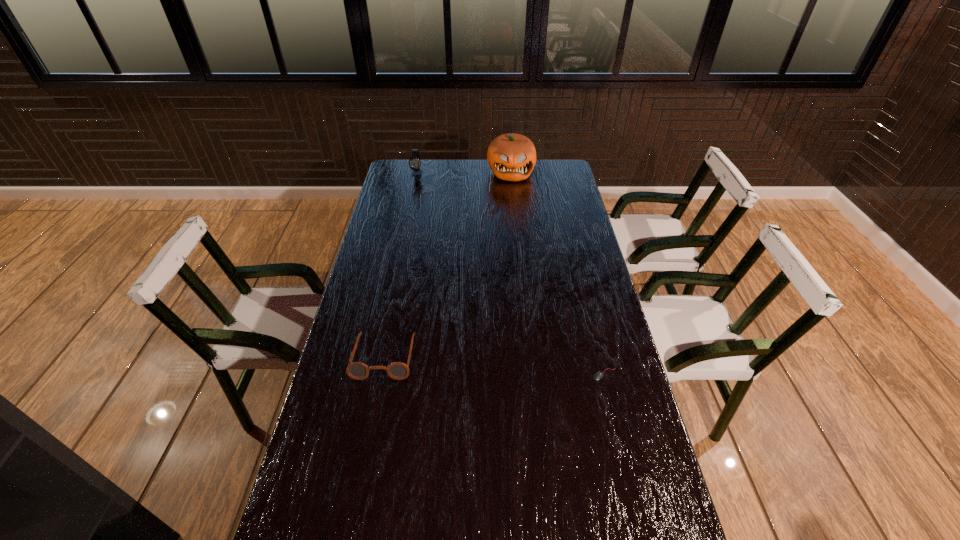
Locate an element on the screen. pumpkin is located at coordinates (511, 157).

Find the location of a particular element. The width and height of the screenshot is (960, 540). the second object from right to left is located at coordinates (511, 157).

Find the location of a particular element. the third shortest object is located at coordinates (414, 162).

This screenshot has height=540, width=960. I want to click on the third tallest object, so click(x=356, y=370).

Identify the location of mouse. Image resolution: width=960 pixels, height=540 pixels. (598, 375).

I want to click on the rightmost object, so click(x=598, y=375).

Locate an element on the screen. This screenshot has width=960, height=540. vacant space situated on the face of the tallest object is located at coordinates [516, 229].

Locate an element on the screen. vacant region located on the face of the watch is located at coordinates (416, 185).

Locate an element on the screen. free point located 0.270m on the front-facing side of the spectacles is located at coordinates (361, 476).

At what (x,y) coordinates should I click in order to perform the action: click on free space located 0.170m on the left of the rightmost object. Please return your answer as a coordinate pair (x, y). Looking at the image, I should click on (533, 374).